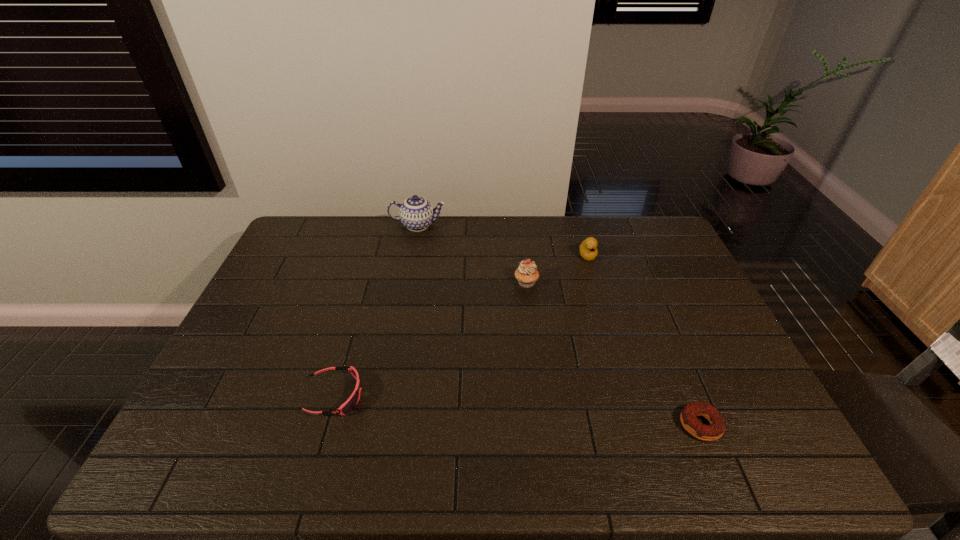
Find the location of a particular element. The height and width of the screenshot is (540, 960). free space in the image that satisfies the following two spatial constraints: 1. at the spout of the tallest object; 2. on the back side of the doughnut is located at coordinates (381, 425).

The image size is (960, 540). Find the location of `vacant region that satisfies the following two spatial constraints: 1. at the spout of the chinaware; 2. on the back side of the shortest object`. vacant region that satisfies the following two spatial constraints: 1. at the spout of the chinaware; 2. on the back side of the shortest object is located at coordinates (381, 425).

In order to click on free point that satisfies the following two spatial constraints: 1. at the spout of the chinaware; 2. on the back side of the third object from left to right in this screenshot , I will do coord(407,282).

At what (x,y) coordinates should I click in order to perform the action: click on blank space that satisfies the following two spatial constraints: 1. on the front-facing side of the fourth tallest object; 2. on the right side of the shortest object. Please return your answer as a coordinate pair (x, y). Image resolution: width=960 pixels, height=540 pixels. Looking at the image, I should click on (325, 425).

Locate an element on the screen. This screenshot has height=540, width=960. free region that satisfies the following two spatial constraints: 1. on the face of the duckling; 2. on the front-facing side of the goggles is located at coordinates (629, 396).

Find the location of `vacant space that satisfies the following two spatial constraints: 1. at the spout of the chinaware; 2. on the left side of the shortest object`. vacant space that satisfies the following two spatial constraints: 1. at the spout of the chinaware; 2. on the left side of the shortest object is located at coordinates pyautogui.click(x=381, y=425).